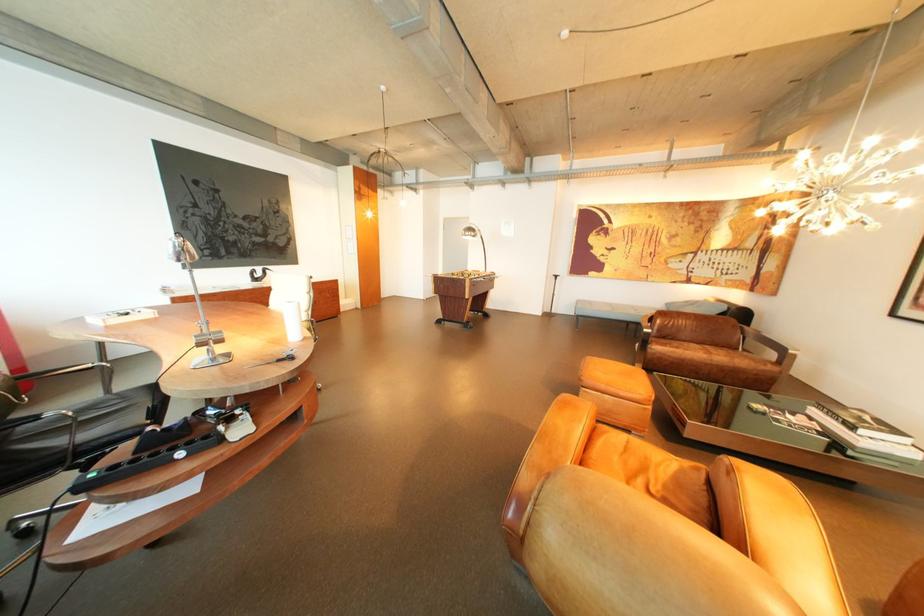
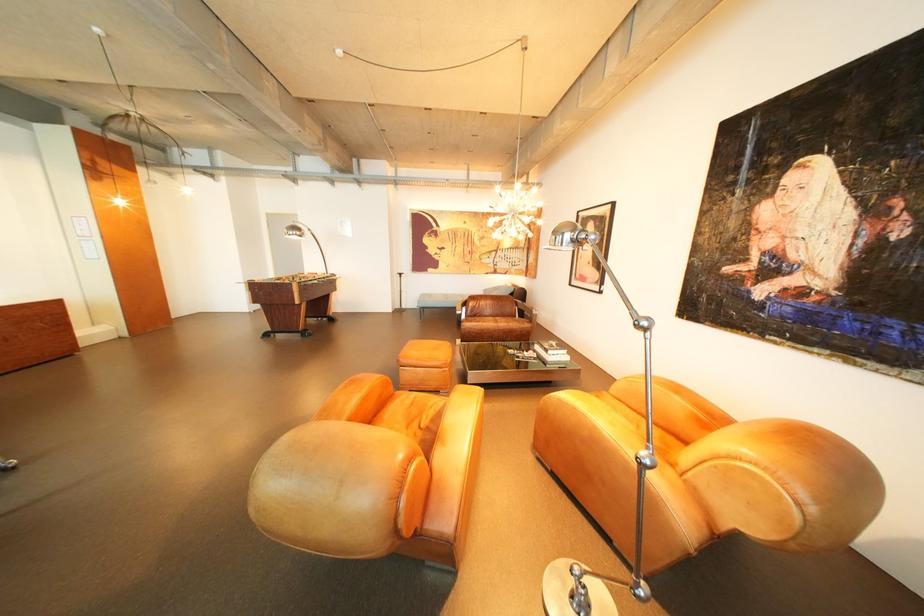
Find the pixel in the second image that matches [625,390] in the first image.

(433, 363)